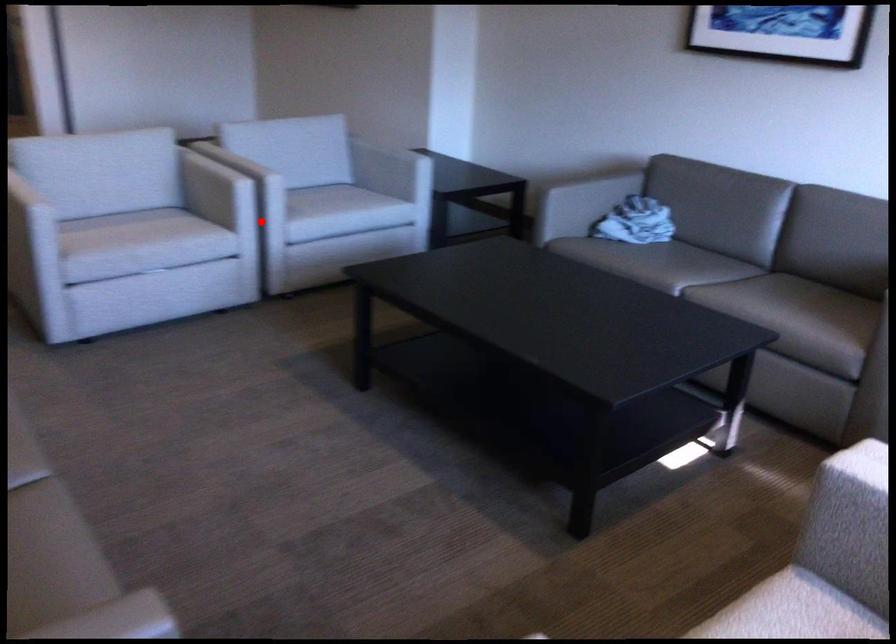
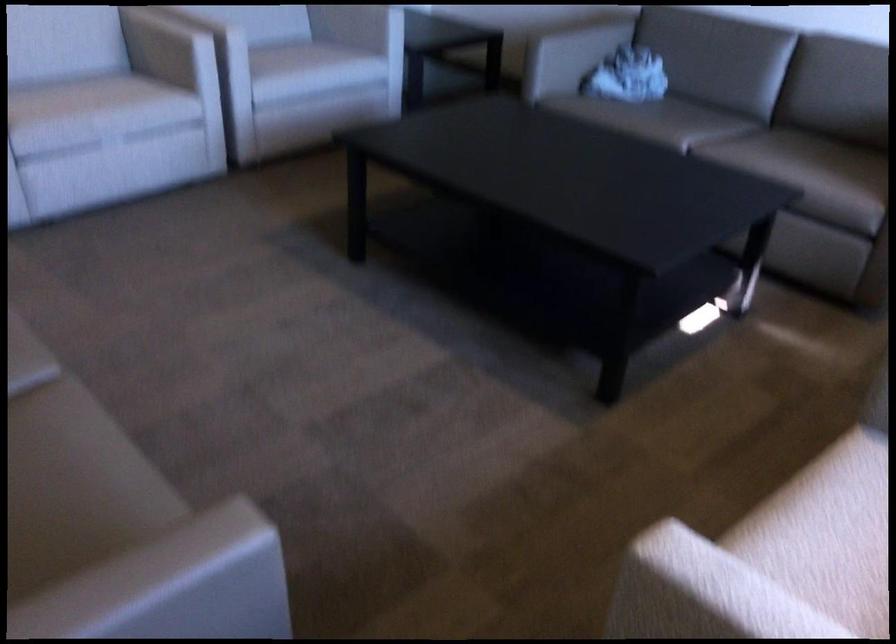
Question: I am providing you with two images of the same scene from different viewpoints. In image1, a red point is highlighted. Considering the same 3D point in image2, which of the following is correct?

Choices:
 (A) It is closer
 (B) It is farther

Answer: (A)